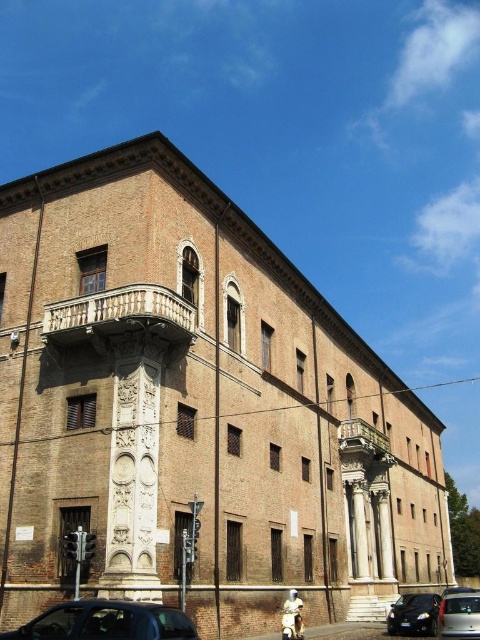
Based on the photo, you are standing in front of the historic building and want to determine the relative positions of two points marked on the facade. Which of the two points, point 1 at coordinates point (154, 637) or point 2 at coordinates point (432, 632), is closer to you?

Point 1 at coordinates point (154, 637) is closer to the viewer than point 2 at coordinates point (432, 632).

You are standing in front of a historic building and want to take a photo of the point at coordinates point (84, 611). If your camera has a minimum focus distance of 80 feet, will it be able to focus on that point?

The distance of point (84, 611) from the camera is 89.78 feet, which is greater than the camera minimum focus distance of 80 feet. Therefore, the camera should be able to focus on that point.

You are a photographer standing in front of the historic building. You want to take a photo that includes both shiny black car at lower left and shiny black car at lower right. Which car should you move closer to the building to ensure both are fully visible in the frame?

The shiny black car at lower left is positioned over the shiny black car at lower right. To ensure both are fully visible, you should move the shiny black car at lower left away from the building so it doesn